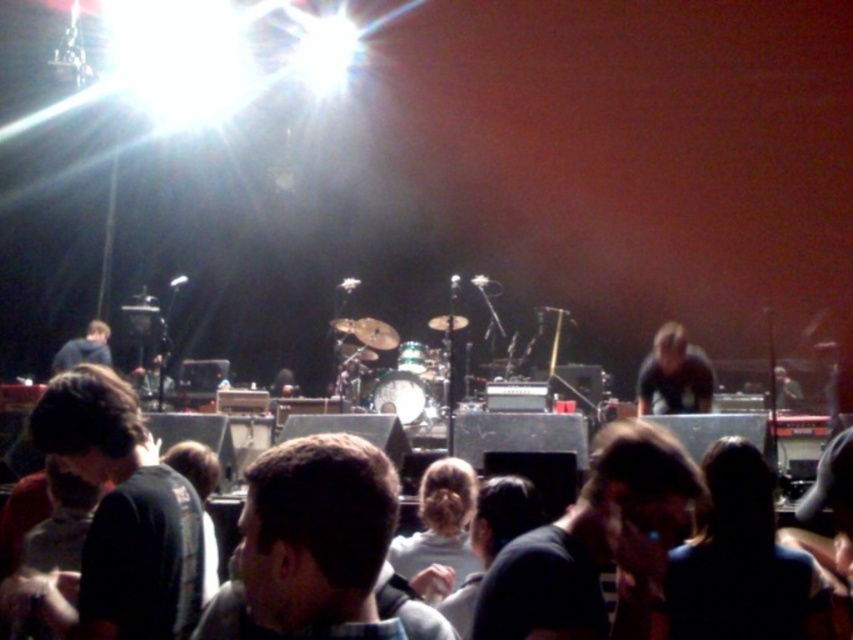
The height and width of the screenshot is (640, 853). What do you see at coordinates (596, 544) in the screenshot?
I see `dark brown hair at center` at bounding box center [596, 544].

The height and width of the screenshot is (640, 853). I want to click on dark brown hair at center, so click(x=596, y=544).

What do you see at coordinates (596, 544) in the screenshot?
I see `dark brown hair at center` at bounding box center [596, 544].

Find the location of a particular element. dark brown hair at center is located at coordinates (596, 544).

Between brown hair at center and light brown hair at center, which one appears on the right side from the viewer's perspective?

From the viewer's perspective, light brown hair at center appears more on the right side.

Is brown hair at center to the left of light brown hair at center from the viewer's perspective?

Indeed, brown hair at center is positioned on the left side of light brown hair at center.

In order to click on brown hair at center in this screenshot , I will do `click(309, 545)`.

Does black matte shirt at center lie in front of dark gray shirt at center?

Yes, it is in front of dark gray shirt at center.

Can you confirm if black matte shirt at center is positioned above dark gray shirt at center?

No, black matte shirt at center is not above dark gray shirt at center.

Find the location of a particular element. Image resolution: width=853 pixels, height=640 pixels. black matte shirt at center is located at coordinates (115, 522).

Image resolution: width=853 pixels, height=640 pixels. What are the coordinates of `black matte shirt at center` in the screenshot? It's located at (115, 522).